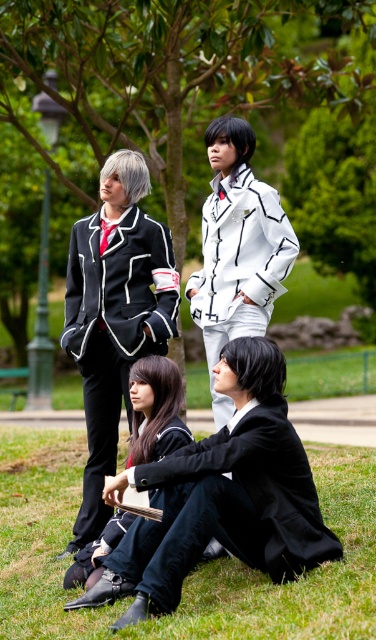
You are a photographer setting up for a group photo. You need to position the matte black suit at left and the white matte jacket at center so that both are visible in the frame. Given their sizes, which object should be placed closer to the camera to ensure they appear balanced in size?

The matte black suit at left is smaller than the white matte jacket at center. To balance their sizes in the photo, place the smaller matte black suit at left closer to the camera so it appears larger in the frame, while the larger white matte jacket at center can be positioned further back.

You are planning to set up a small picnic in the park where the green grass at lower center and the matte black suit at left are located. Considering their sizes, which one would require more space to accommodate?

The green grass at lower center is larger in size than the matte black suit at left, so it would require more space to accommodate.